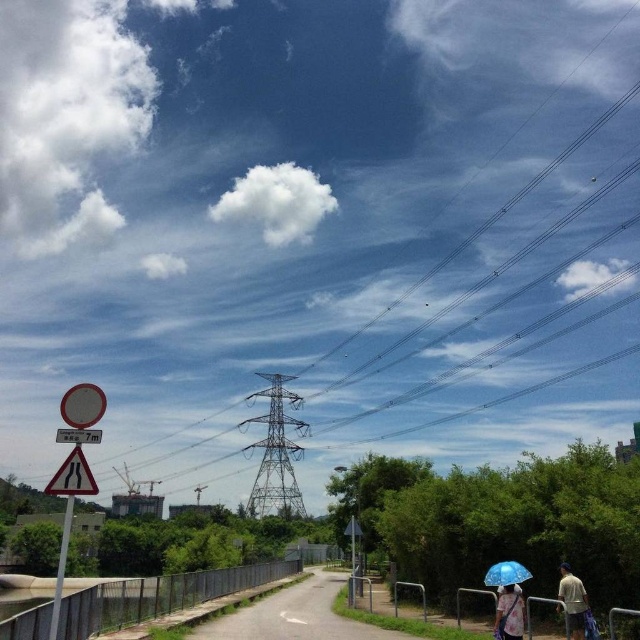
You are driving a truck that is 7 meters tall. You see the smooth asphalt road at center and the yellow reflective plastic road sign at lower left. Can your truck pass under the road sign?

The yellow reflective plastic road sign at lower left is behind the smooth asphalt road at center, so the truck cannot pass under it because the sign is not on the road path.

From the picture: You are a delivery driver who needs to transport a 200 meter long pipe through the area shown in the image. You see the metallic wire at upper center and the blue fabric umbrella at lower right. Can you determine if the pipe will fit between these two objects without bending it?

The metallic wire at upper center is 193.38 meters from the blue fabric umbrella at lower right. Since the pipe is 200 meters long, it is longer than the distance between the two objects. Therefore, the pipe cannot fit between them without bending.